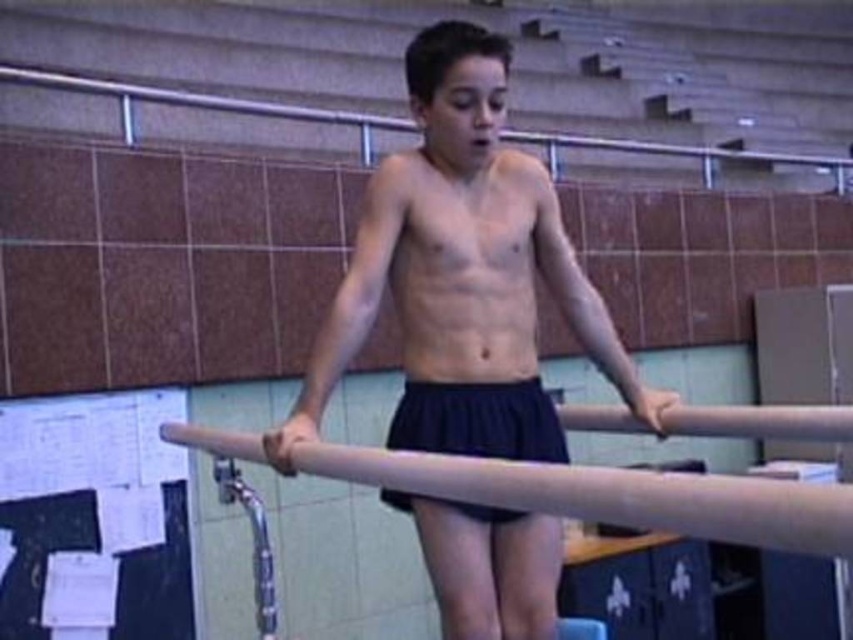
Can you confirm if white paper at left is positioned below smooth wood beam at center?

Indeed, white paper at left is positioned under smooth wood beam at center.

Between point (155, 548) and point (660, 493), which one is positioned in front?

Point (660, 493) is more forward.

Is point (38, 470) behind point (776, 525)?

Yes, point (38, 470) is farther from viewer.

The image size is (853, 640). Find the location of `white paper at left`. white paper at left is located at coordinates (93, 518).

Between black fabric shorts at center and metallic rail at upper center, which one appears on the left side from the viewer's perspective?

black fabric shorts at center is more to the left.

Find the location of a particular element. black fabric shorts at center is located at coordinates (486, 566).

Identify the location of black fabric shorts at center. (486, 566).

Does point (512, 624) come in front of point (22, 579)?

Yes.

Which is more to the left, smooth skin man at center or white paper at left?

white paper at left is more to the left.

Between point (527, 312) and point (70, 536), which one is positioned in front?

Point (527, 312)

The width and height of the screenshot is (853, 640). Identify the location of smooth skin man at center. (462, 275).